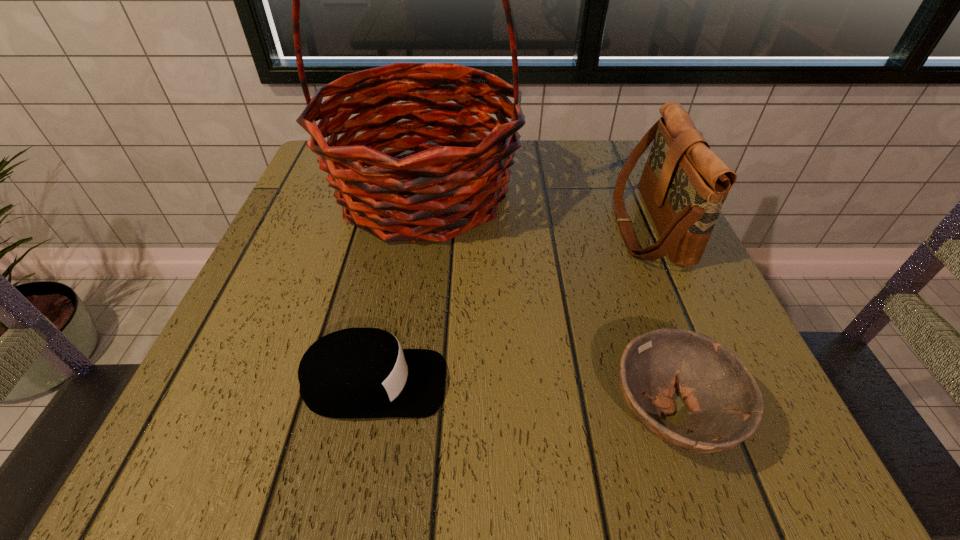
Where is `free space between the second tallest object and the basket`? free space between the second tallest object and the basket is located at coordinates (536, 209).

The width and height of the screenshot is (960, 540). I want to click on free space between the cap and the third shortest object, so click(511, 305).

Where is `free point between the second tallest object and the cap`? Image resolution: width=960 pixels, height=540 pixels. free point between the second tallest object and the cap is located at coordinates (511, 305).

Locate an element on the screen. Image resolution: width=960 pixels, height=540 pixels. empty space between the bowl and the cap is located at coordinates (522, 399).

Find the location of a particular element. free spot between the bowl and the second tallest object is located at coordinates (660, 320).

Locate an element on the screen. Image resolution: width=960 pixels, height=540 pixels. vacant space that is in between the cap and the basket is located at coordinates (399, 288).

Locate an element on the screen. The height and width of the screenshot is (540, 960). vacant area that lies between the shoulder bag and the bowl is located at coordinates (660, 320).

Where is `free spot between the shoulder bag and the basket`? Image resolution: width=960 pixels, height=540 pixels. free spot between the shoulder bag and the basket is located at coordinates (536, 209).

Identify which object is the third nearest to the tallest object. Please provide its 2D coordinates. Your answer should be formatted as a tuple, i.e. [(x, y)], where the tuple contains the x and y coordinates of a point satisfying the conditions above.

[(725, 403)]

Identify which object is located as the third nearest to the basket. Please provide its 2D coordinates. Your answer should be formatted as a tuple, i.e. [(x, y)], where the tuple contains the x and y coordinates of a point satisfying the conditions above.

[(725, 403)]